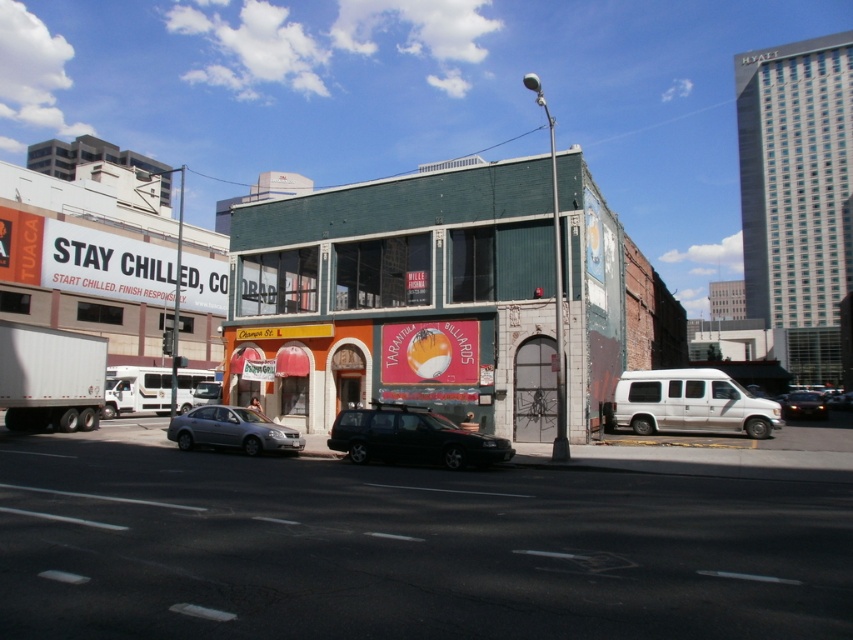
Question: Which point is farther to the camera?

Choices:
 (A) (820, 410)
 (B) (653, 380)
 (C) (294, 433)

Answer: (A)

Question: Is silver metallic van at right thinner than shiny black suv at center?

Choices:
 (A) yes
 (B) no

Answer: (B)

Question: Is green brick building at center bigger than shiny black sedan at center?

Choices:
 (A) yes
 (B) no

Answer: (B)

Question: Which point is farther from the camera taking this photo?

Choices:
 (A) (186, 442)
 (B) (643, 374)

Answer: (B)

Question: Where is shiny black suv at center located in relation to silver metallic sedan at center in the image?

Choices:
 (A) above
 (B) below

Answer: (A)

Question: Which point is closer to the camera?

Choices:
 (A) (735, 406)
 (B) (190, 444)
 (C) (552, 394)

Answer: (B)